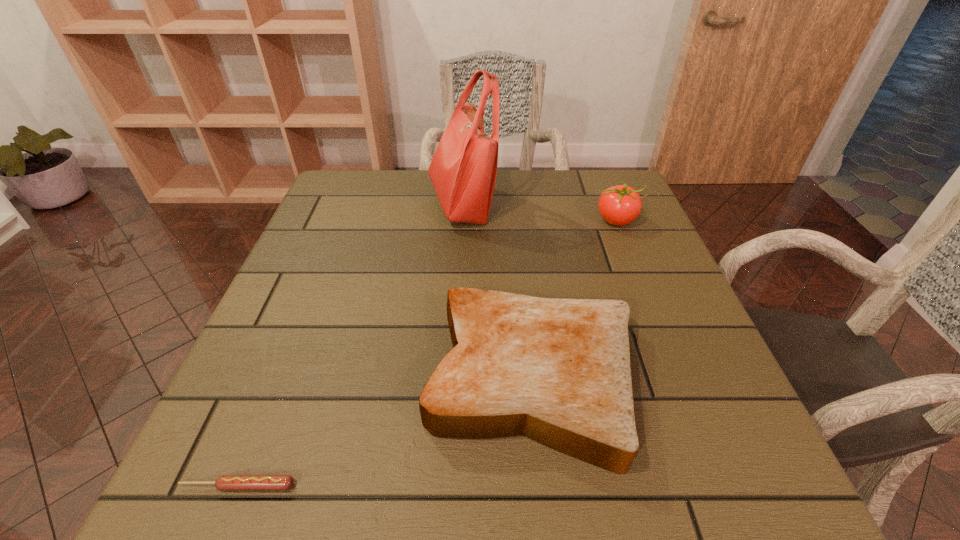
Identify the location of vacant region that satisfies the following two spatial constraints: 1. on the front-facing side of the tallest object; 2. on the front side of the sausage. The width and height of the screenshot is (960, 540). (445, 486).

The image size is (960, 540). In order to click on vacant space that satisfies the following two spatial constraints: 1. on the front-facing side of the tallest object; 2. on the left side of the rightmost object in this screenshot , I will do `click(461, 220)`.

Identify the location of vacant space that satisfies the following two spatial constraints: 1. on the back side of the third farthest object; 2. on the right side of the tomato. The width and height of the screenshot is (960, 540). (516, 220).